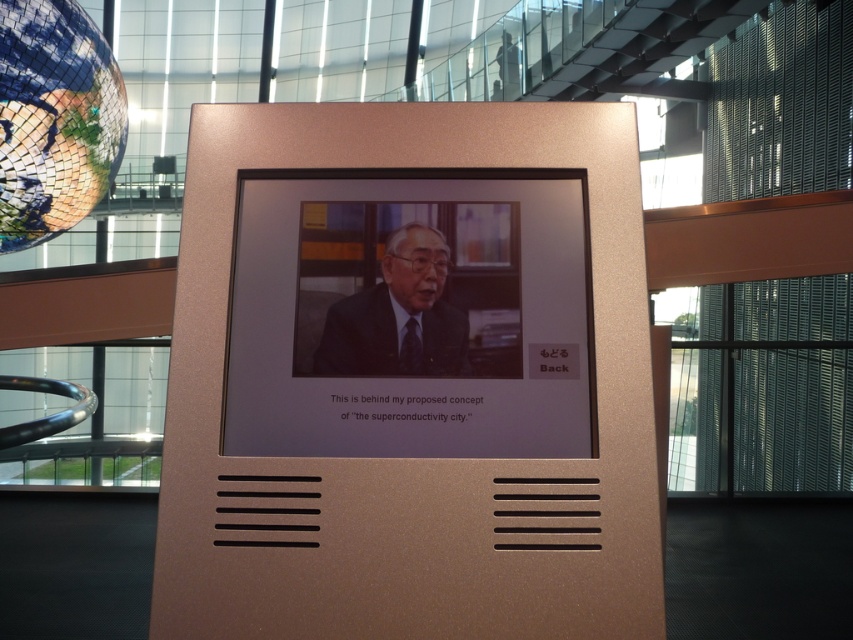
You are standing in front of the kiosk and need to determine which object is taller between the gold metallic plaque at center and the satin gold frame at center. Which one is taller?

The gold metallic plaque at center is taller than the satin gold frame at center.

You are an interior designer evaluating the placement of the satin gold frame at center and the reflective mosaic globe at upper left in the image. Which object is closer to the viewer?

The satin gold frame at center is closer to the viewer than the reflective mosaic globe at upper left because it is positioned in front of it.

You are a maintenance technician with a 1.5 meter long tool. You need to reach the satin gold frame at center to perform maintenance. Can you reach it with your current tool?

The distance between the satin gold frame at center and the camera is 1.28 meters. Since your tool is 1.5 meters long, it is longer than the required distance, so you can reach the satin gold frame at center for maintenance.